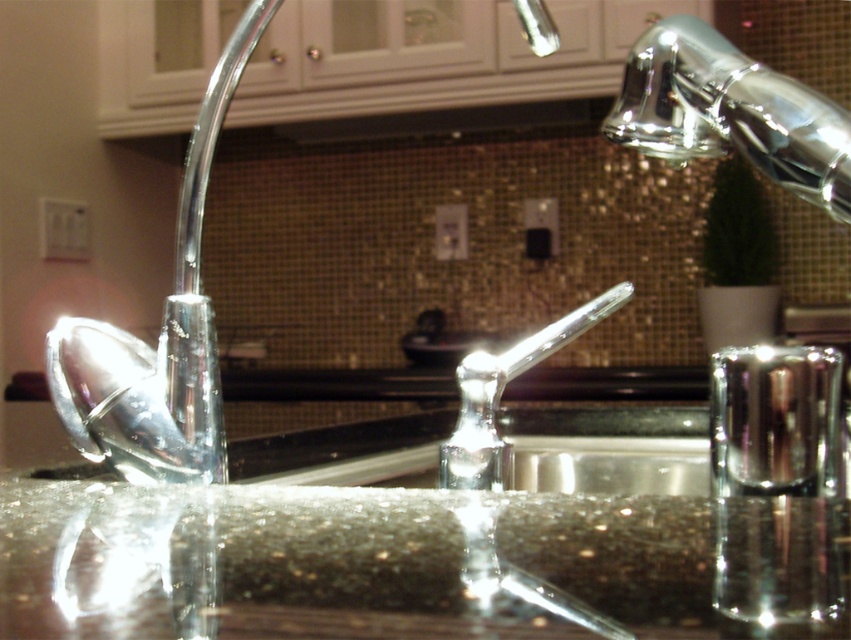
Does chrome metallic faucet at upper right have a lesser width compared to polished chrome faucet at center?

Indeed, chrome metallic faucet at upper right has a lesser width compared to polished chrome faucet at center.

Can you confirm if chrome metallic faucet at upper right is positioned below polished chrome faucet at center?

Actually, chrome metallic faucet at upper right is above polished chrome faucet at center.

Is point (778, 100) less distant than point (473, 396)?

Yes, it is in front of point (473, 396).

The height and width of the screenshot is (640, 851). In order to click on chrome metallic faucet at upper right in this screenshot , I will do `click(730, 113)`.

Which is more to the right, shiny granite sink at center or chrome metallic faucet at upper right?

From the viewer's perspective, chrome metallic faucet at upper right appears more on the right side.

Is point (29, 545) closer to viewer compared to point (832, 205)?

Yes.

Image resolution: width=851 pixels, height=640 pixels. I want to click on shiny granite sink at center, so click(414, 563).

Based on the photo, is shiny granite sink at center to the left of polished chrome faucet at center from the viewer's perspective?

Correct, you'll find shiny granite sink at center to the left of polished chrome faucet at center.

Who is more distant from viewer, (643,580) or (457,458)?

The point (457,458) is more distant.

Locate an element on the screen. shiny granite sink at center is located at coordinates (414, 563).